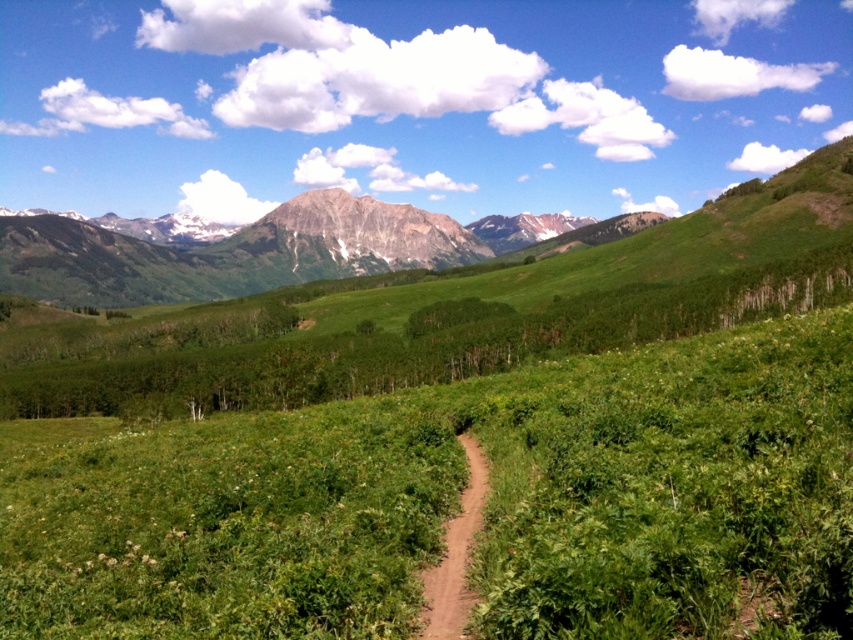
You are standing at the starting point of the dirt path in the mountain landscape. You notice the green leafy grass at center. Based on its position, can you determine if it is closer to you or further away compared to the scattered trees in the midground?

The green leafy grass at center is located at point (457, 504), which places it closer to the foreground compared to the scattered trees in the midground, so it is closer to you.

You are a hiker trying to follow the dirt path through the mountain landscape. As you look ahead, you see the green leafy grass at center and the brown dirt path at center. Which of these two features is positioned lower in the scene?

The green leafy grass at center is positioned below the brown dirt path at center, so it is lower in the scene.